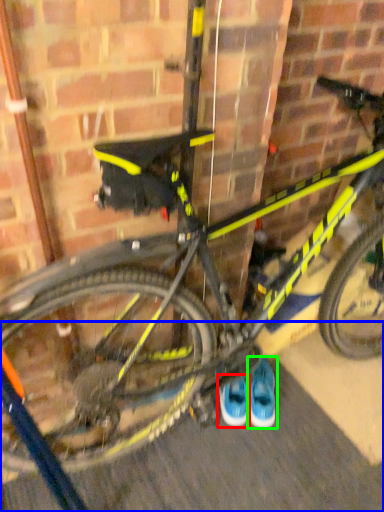
Question: Which is farther away from footwear (highlighted by a red box)? pavement (highlighted by a blue box) or footwear (highlighted by a green box)?

Choices:
 (A) pavement
 (B) footwear

Answer: (A)